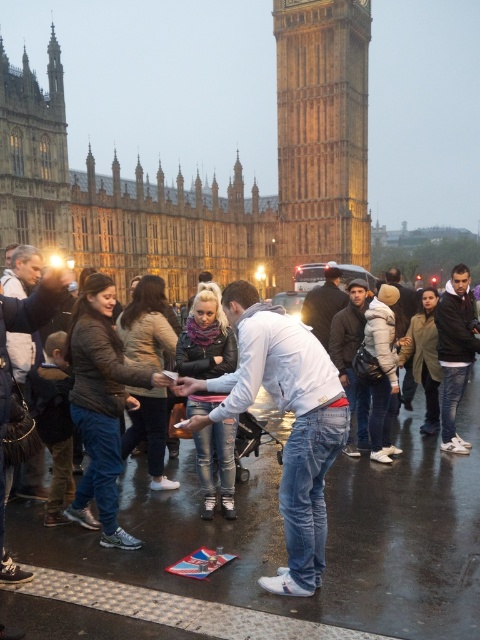
Question: Is ripped denim jeans at center wider than denim jacket at center?

Choices:
 (A) no
 (B) yes

Answer: (A)

Question: Which point is farther to the camera?

Choices:
 (A) brown stone tower at upper center
 (B) denim jacket at center
 (C) ripped denim jeans at center

Answer: (A)

Question: Can you confirm if brown stone tower at upper center is positioned above white fleece jacket at center?

Choices:
 (A) yes
 (B) no

Answer: (A)

Question: Which point is closer to the camera?

Choices:
 (A) denim jacket at center
 (B) denim jacket at lower left
 (C) brown stone tower at upper center
 (D) white fleece jacket at center

Answer: (B)

Question: Is denim jacket at lower left bigger than denim jacket at center?

Choices:
 (A) no
 (B) yes

Answer: (B)

Question: Which of the following is the farthest from the observer?

Choices:
 (A) ripped denim jeans at center
 (B) denim jacket at lower left
 (C) green wool coat at center

Answer: (C)